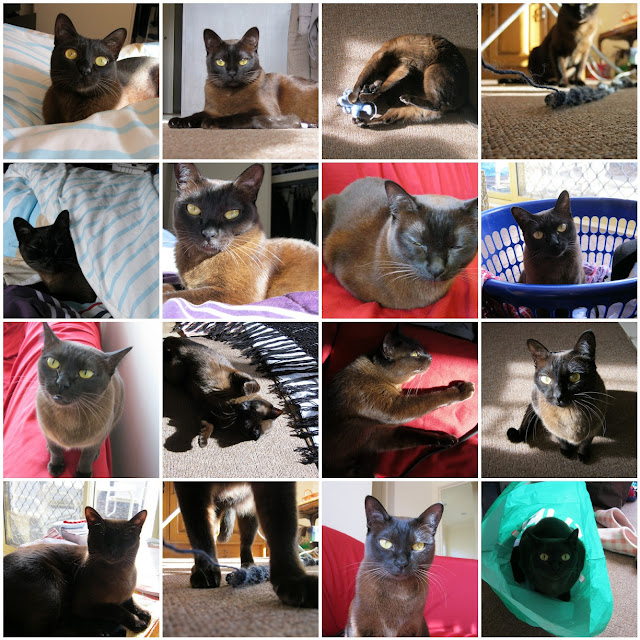
I want to click on laundry basket, so click(x=513, y=289).